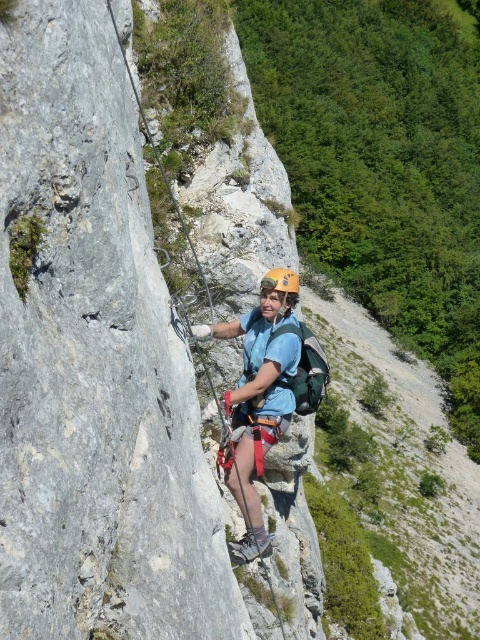
Question: In this image, where is matte blue shirt at center located relative to yellow matte helmet at center?

Choices:
 (A) above
 (B) below

Answer: (B)

Question: Is matte blue shirt at center positioned behind yellow matte helmet at center?

Choices:
 (A) no
 (B) yes

Answer: (A)

Question: Which of the following is the farthest from the observer?

Choices:
 (A) (202, 326)
 (B) (296, 298)

Answer: (A)

Question: Is matte blue shirt at center positioned behind yellow matte helmet at center?

Choices:
 (A) no
 (B) yes

Answer: (A)